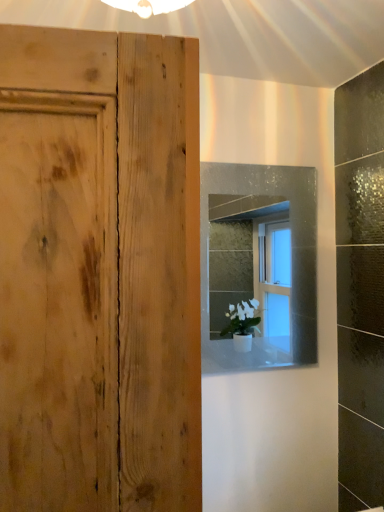
The image size is (384, 512). Describe the element at coordinates (259, 263) in the screenshot. I see `clear glass window at center` at that location.

This screenshot has height=512, width=384. In order to click on clear glass window at center in this screenshot , I will do `click(259, 263)`.

Measure the distance between clear glass window at center and camera.

clear glass window at center and camera are 1.61 meters apart.

What is the approximate height of clear glass window at center?

The height of clear glass window at center is 84.26 centimeters.

This screenshot has height=512, width=384. In order to click on clear glass window at center in this screenshot , I will do `click(259, 263)`.